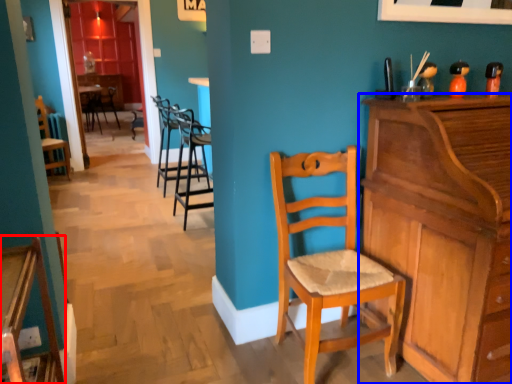
Question: Which of the following is the closest to the observer, chair (highlighted by a red box) or cabinetry (highlighted by a blue box)?

Choices:
 (A) chair
 (B) cabinetry

Answer: (A)